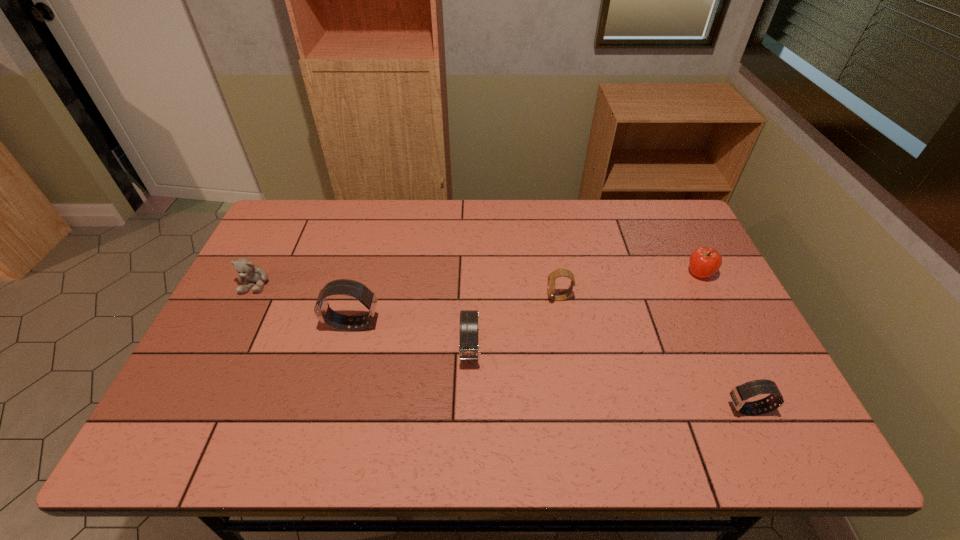
I want to click on free area in between the leftmost object and the second watch from right to left, so coord(408,291).

The width and height of the screenshot is (960, 540). What are the coordinates of `free space between the third object from left to right and the leftmost watch` in the screenshot? It's located at (411, 338).

Identify which object is located as the fifth nearest to the rightmost watch. Please provide its 2D coordinates. Your answer should be formatted as a tuple, i.e. [(x, y)], where the tuple contains the x and y coordinates of a point satisfying the conditions above.

[(246, 269)]

This screenshot has height=540, width=960. I want to click on object that is the fourth closest to the leftmost watch, so click(x=739, y=394).

Point out which watch is positioned as the second nearest to the farthest watch. Please provide its 2D coordinates. Your answer should be formatted as a tuple, i.e. [(x, y)], where the tuple contains the x and y coordinates of a point satisfying the conditions above.

[(739, 394)]

Identify which watch is the third closest to the leftmost object. Please provide its 2D coordinates. Your answer should be formatted as a tuple, i.e. [(x, y)], where the tuple contains the x and y coordinates of a point satisfying the conditions above.

[(561, 272)]

Where is `free location that satisfies the following two spatial constraints: 1. on the front side of the apple; 2. on the face of the third watch from left to right`? free location that satisfies the following two spatial constraints: 1. on the front side of the apple; 2. on the face of the third watch from left to right is located at coordinates (710, 298).